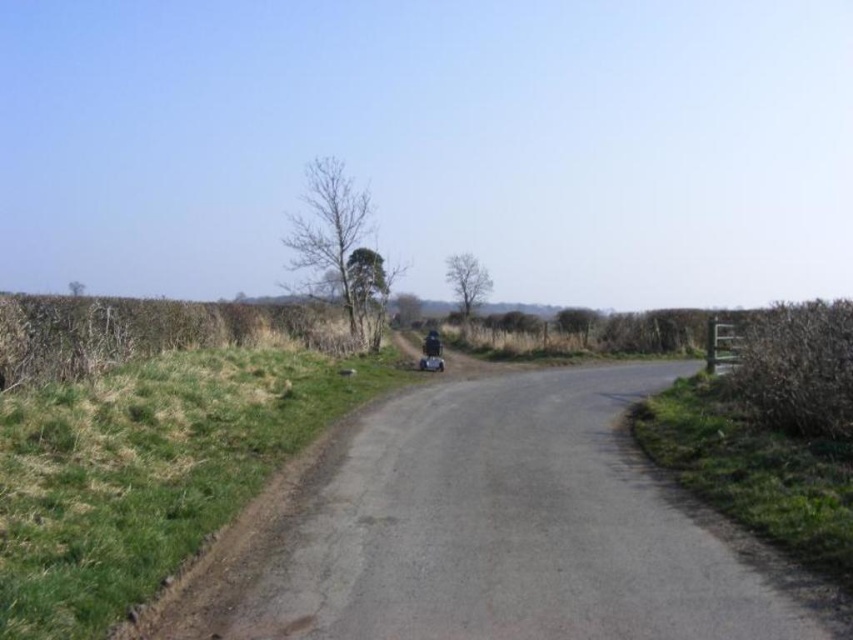
Question: Which object is farther from the camera taking this photo?

Choices:
 (A) brown dry hedge at left
 (B) shiny black helmet at center

Answer: (B)

Question: Which of these objects is positioned closest to the shiny black helmet at center?

Choices:
 (A) brown dry hedge at left
 (B) brown textured hedge at right
 (C) shiny black motorcycle at center
 (D) asphalt road at center

Answer: (C)

Question: Can you confirm if brown textured hedge at right is positioned below shiny black motorcycle at center?

Choices:
 (A) yes
 (B) no

Answer: (B)

Question: Is asphalt road at center above shiny black motorcycle at center?

Choices:
 (A) yes
 (B) no

Answer: (B)

Question: Is asphalt road at center positioned at the back of brown textured hedge at right?

Choices:
 (A) yes
 (B) no

Answer: (B)

Question: Which point is farther to the camera?

Choices:
 (A) (827, 312)
 (B) (434, 356)

Answer: (B)